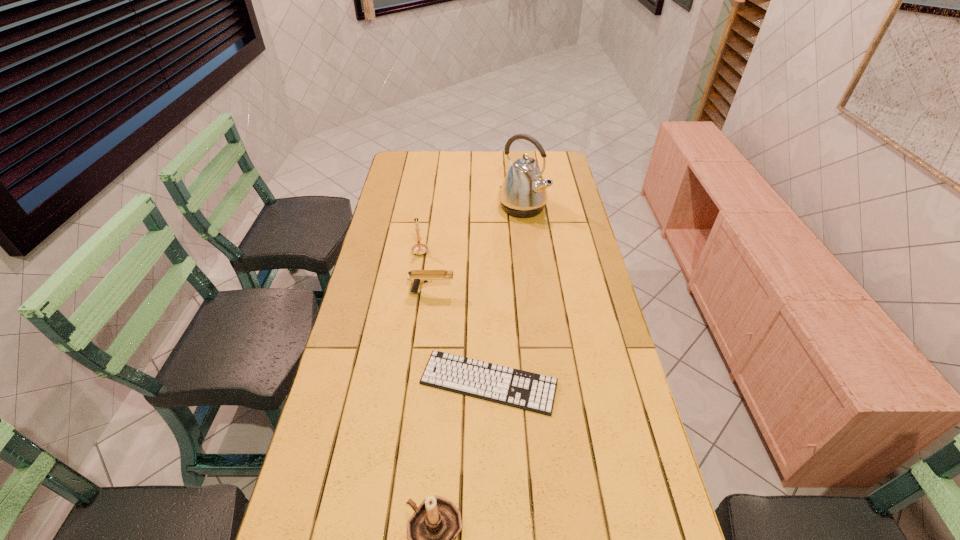
You are a GUI agent. You are given a task and a screenshot of the screen. Output one action in this format:
    pyautogui.click(x=<x>, y=<y>)
    Task: Click on the farthest object
    The width and height of the screenshot is (960, 540).
    Given the screenshot: What is the action you would take?
    pyautogui.click(x=523, y=193)

At what (x,y) coordinates should I click in order to perform the action: click on kettle. Please return your answer as a coordinate pair (x, y). Looking at the image, I should click on (523, 193).

Identify the location of the left candle holder. The width and height of the screenshot is (960, 540). (419, 248).

Locate an element on the screen. This screenshot has height=540, width=960. the fourth nearest object is located at coordinates (419, 248).

Where is `pistol`? pistol is located at coordinates (417, 277).

Locate an element on the screen. Image resolution: width=960 pixels, height=540 pixels. the third farthest object is located at coordinates (417, 277).

At what (x,y) coordinates should I click in order to perform the action: click on the shortest object. Please return your answer as a coordinate pair (x, y). Looking at the image, I should click on [516, 388].

The width and height of the screenshot is (960, 540). I want to click on the second nearest object, so click(x=516, y=388).

I want to click on vacant space located 0.090m on the back of the tallest object, so click(x=519, y=183).

You are a GUI agent. You are given a task and a screenshot of the screen. Output one action in this format:
    pyautogui.click(x=<x>, y=<y>)
    Task: Click on the free location located 0.190m on the handle side of the left candle holder
    This screenshot has width=960, height=540.
    Given the screenshot: What is the action you would take?
    pyautogui.click(x=426, y=213)